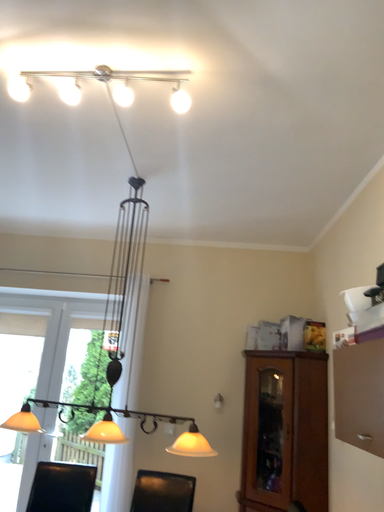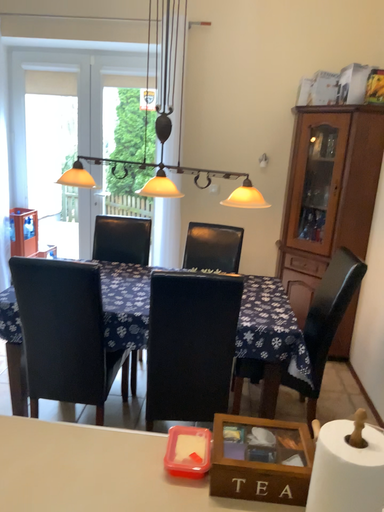
Question: Which way did the camera rotate in the video?

Choices:
 (A) rotated upward
 (B) rotated downward

Answer: (B)